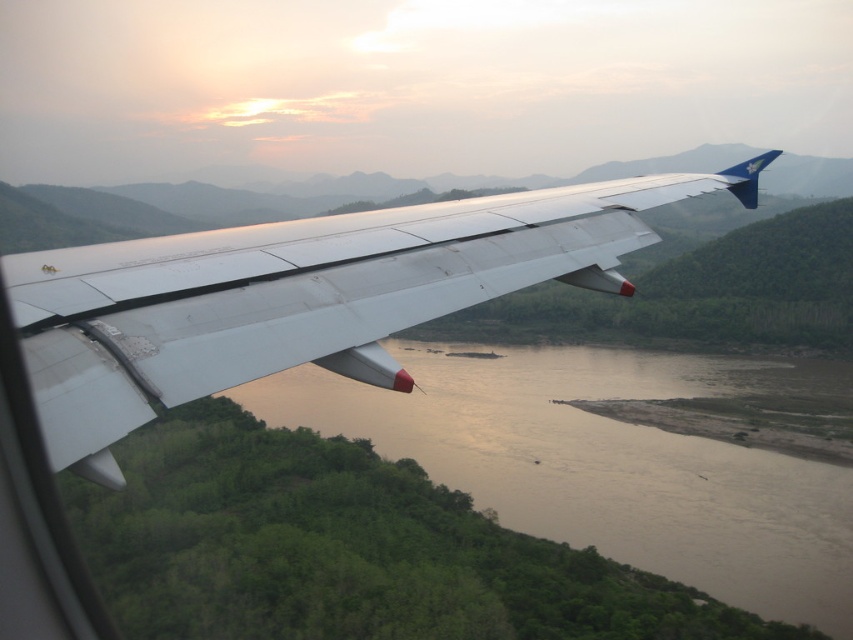
Question: Can you confirm if white metallic wing at center is bigger than brown muddy water at center?

Choices:
 (A) yes
 (B) no

Answer: (B)

Question: Which of the following is the farthest from the observer?

Choices:
 (A) white metallic wing at center
 (B) brown muddy water at center

Answer: (B)

Question: Which object is farther from the camera taking this photo?

Choices:
 (A) white metallic wing at center
 (B) brown muddy water at center

Answer: (B)

Question: Can you confirm if white metallic wing at center is thinner than brown muddy water at center?

Choices:
 (A) yes
 (B) no

Answer: (A)

Question: Which point appears closest to the camera in this image?

Choices:
 (A) (410, 456)
 (B) (328, 282)

Answer: (B)

Question: Considering the relative positions of white metallic wing at center and brown muddy water at center in the image provided, where is white metallic wing at center located with respect to brown muddy water at center?

Choices:
 (A) left
 (B) right

Answer: (A)